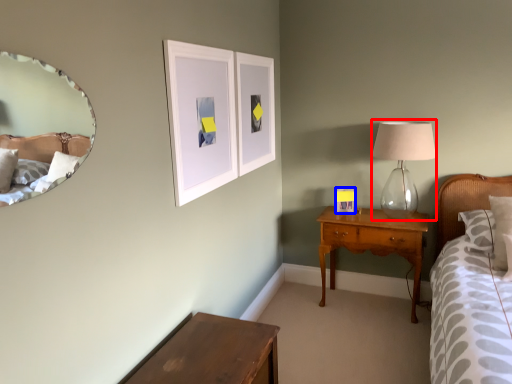
Question: Among these objects, which one is farthest to the camera, table lamp (highlighted by a red box) or picture frame (highlighted by a blue box)?

Choices:
 (A) table lamp
 (B) picture frame

Answer: (B)